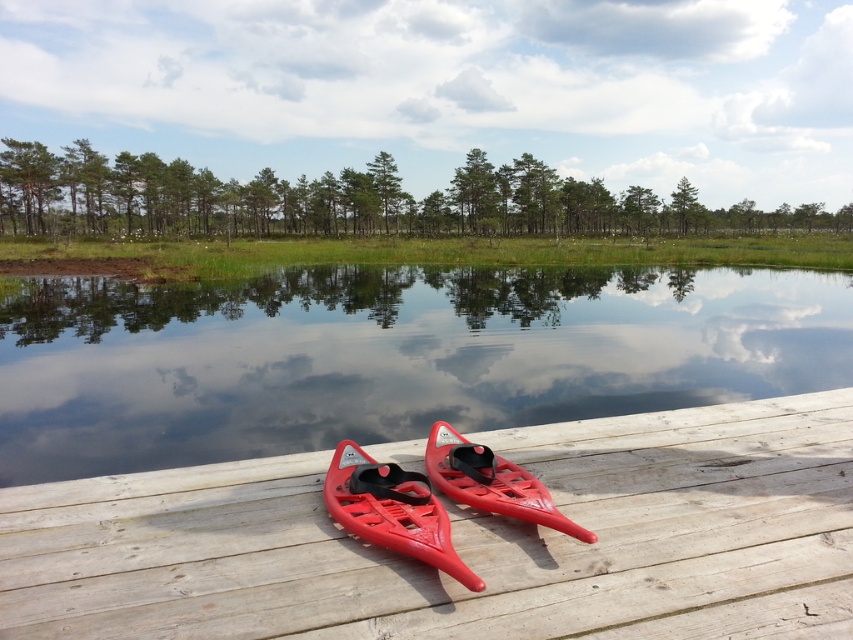
Is the position of transparent water at center more distant than that of glossy plastic canoe at center?

Yes, transparent water at center is further from the viewer.

Between point (316, 394) and point (477, 476), which one is positioned in front?

Point (477, 476)

This screenshot has width=853, height=640. In order to click on transparent water at center in this screenshot , I will do `click(389, 356)`.

In order to click on transparent water at center in this screenshot , I will do `click(389, 356)`.

Measure the distance between matte wood dock at center and camera.

matte wood dock at center and camera are 4.50 feet apart.

Who is taller, matte wood dock at center or glossy plastic canoe at center?

matte wood dock at center is taller.

Is point (503, 529) less distant than point (537, 499)?

No, it is not.

What are the coordinates of `matte wood dock at center` in the screenshot? It's located at (463, 541).

Between matte wood dock at center and transparent water at center, which one is positioned higher?

transparent water at center is above.

Which of these two, matte wood dock at center or transparent water at center, stands shorter?

matte wood dock at center is shorter.

Is point (234, 548) positioned in front of point (791, 323)?

Yes, point (234, 548) is in front of point (791, 323).

Where is `matte wood dock at center`? Image resolution: width=853 pixels, height=640 pixels. matte wood dock at center is located at coordinates (463, 541).